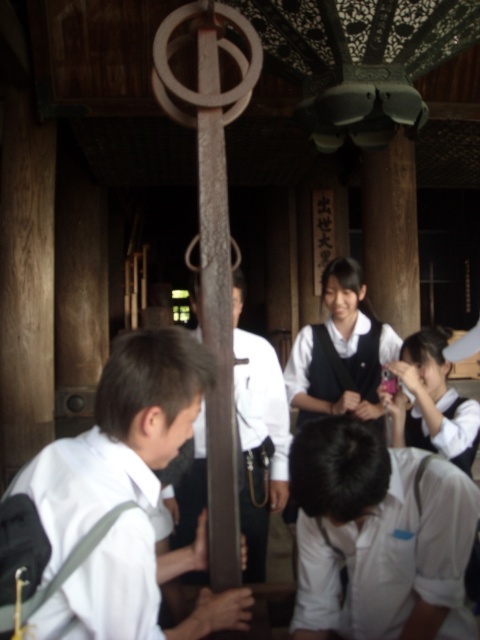
Is point (155, 506) less distant than point (408, 410)?

Yes, it is.

Is white matte uniform at center further to the viewer compared to white fabric uniform at upper right?

No, white matte uniform at center is in front of white fabric uniform at upper right.

Where is `white matte uniform at center`? This screenshot has height=640, width=480. white matte uniform at center is located at coordinates (127, 497).

This screenshot has height=640, width=480. In order to click on white matte uniform at center in this screenshot , I will do click(127, 497).

Who is shorter, white matte uniform at lower center or white shirt at center?

Standing shorter between the two is white matte uniform at lower center.

Is white matte uniform at lower center positioned in front of white shirt at center?

No, it is behind white shirt at center.

Who is more distant from viewer, (325,609) or (264,477)?

Positioned behind is point (264,477).

Image resolution: width=480 pixels, height=640 pixels. What are the coordinates of `white matte uniform at lower center` in the screenshot? It's located at (392, 556).

Is white matte uniform at center closer to the viewer compared to white fabric uniform at center?

Yes, it is in front of white fabric uniform at center.

Between white matte uniform at center and white fabric uniform at center, which one appears on the left side from the viewer's perspective?

white matte uniform at center is more to the left.

Does point (112, 492) lie in front of point (360, 381)?

Yes, point (112, 492) is closer to viewer.

This screenshot has height=640, width=480. In order to click on white matte uniform at center in this screenshot , I will do `click(127, 497)`.